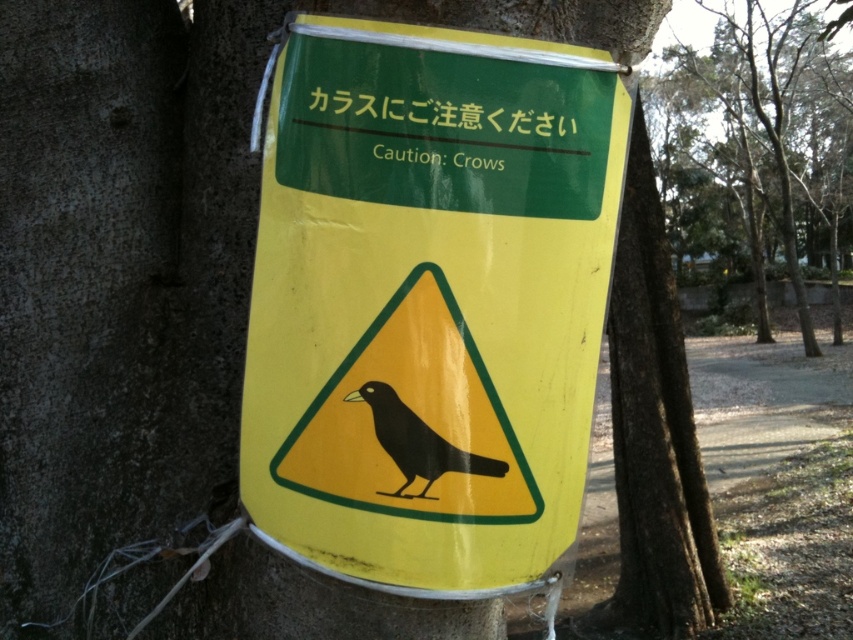
You are standing in a park and see the yellow matte sign at center. If you want to read the text on the sign clearly, do you need to move closer or farther away?

The yellow matte sign at center is 1.43 meters away from you. To read the text clearly, you should move closer because the standard comfortable reading distance for most people is around 30 cm to 1 meter. Since 1.43 meters is beyond that range, moving closer would help improve readability.

You are a park visitor who wants to locate the yellow matte sign at center. According to the scene description, where should you look to find it?

The yellow matte sign at center is located at point (428, 301), so you should look there to find it.